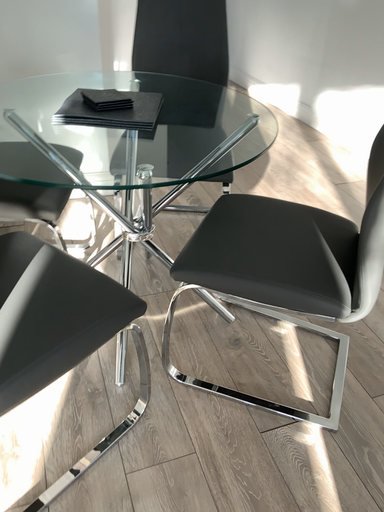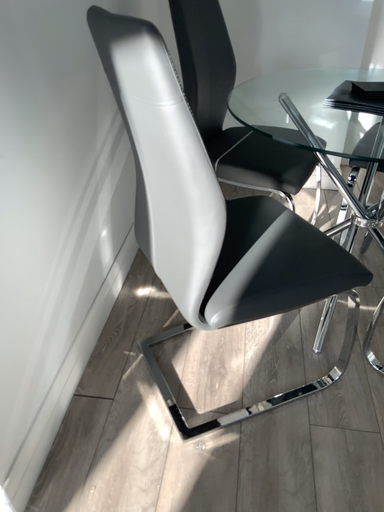
Question: Which way did the camera rotate in the video?

Choices:
 (A) rotated right
 (B) rotated left

Answer: (B)